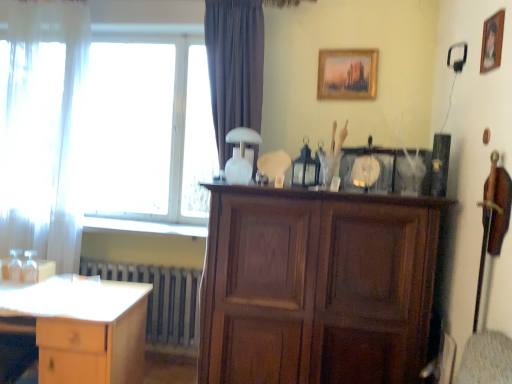
Question: In terms of height, does metallic gray radiator at lower left look taller or shorter compared to gold-framed painting at upper center, which appears as the 2th picture frame when viewed from the front?

Choices:
 (A) short
 (B) tall

Answer: (B)

Question: Is metallic gray radiator at lower left to the left or to the right of gold-framed painting at upper center, which appears as the 2th picture frame when viewed from the front, in the image?

Choices:
 (A) right
 (B) left

Answer: (B)

Question: Based on their relative distances, which object is nearer to the transparent glass window at upper left?

Choices:
 (A) wooden picture frame at upper right, placed as the 2th picture frame when sorted from back to front
 (B) gold-framed painting at upper center, which appears as the 2th picture frame when viewed from the front
 (C) metallic gray radiator at lower left
 (D) wooden cabinet at center
 (E) white sheer curtain at left

Answer: (E)

Question: Which object is the closest to the white sheer curtain at left?

Choices:
 (A) metallic gray radiator at lower left
 (B) light wood desk at lower left
 (C) gold-framed painting at upper center, the 2th picture frame positioned from the right
 (D) transparent glass window at upper left
 (E) wooden cabinet at center

Answer: (D)